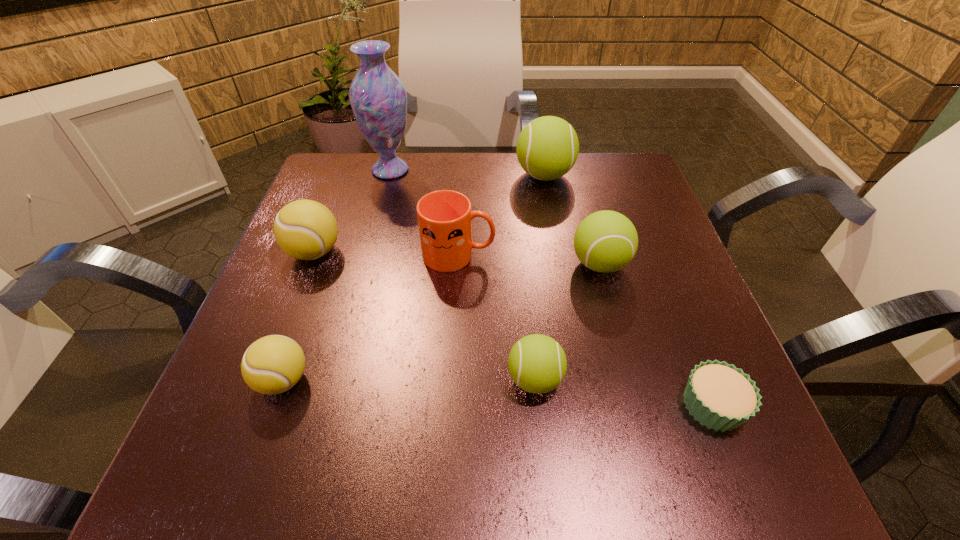
This screenshot has height=540, width=960. Identify the location of purple vase. (378, 98).

Where is `vase`? The image size is (960, 540). vase is located at coordinates (378, 98).

This screenshot has height=540, width=960. What are the coordinates of `the farthest tennis ball` in the screenshot? It's located at (547, 148).

Find the location of a particular element. the biggest green tennis ball is located at coordinates click(547, 148).

This screenshot has height=540, width=960. What are the coordinates of `the fourth object from left to right` in the screenshot? It's located at (x=445, y=217).

At what (x,y) coordinates should I click in order to perform the action: click on mug. Please return your answer as a coordinate pair (x, y). This screenshot has width=960, height=540. Looking at the image, I should click on (445, 217).

Image resolution: width=960 pixels, height=540 pixels. In order to click on the bigger yellow tennis ball in this screenshot , I will do `click(305, 229)`.

At what (x,y) coordinates should I click in order to perform the action: click on the second biggest green tennis ball. Please return your answer as a coordinate pair (x, y). Looking at the image, I should click on (606, 241).

You are a GUI agent. You are given a task and a screenshot of the screen. Output one action in this format:
    pyautogui.click(x=<x>, y=<y>)
    Task: Click on the smallest green tennis ball
    This screenshot has height=540, width=960.
    Given the screenshot: What is the action you would take?
    pyautogui.click(x=537, y=363)

Locate an element on the screen. The height and width of the screenshot is (540, 960). the nearer yellow tennis ball is located at coordinates (273, 364).